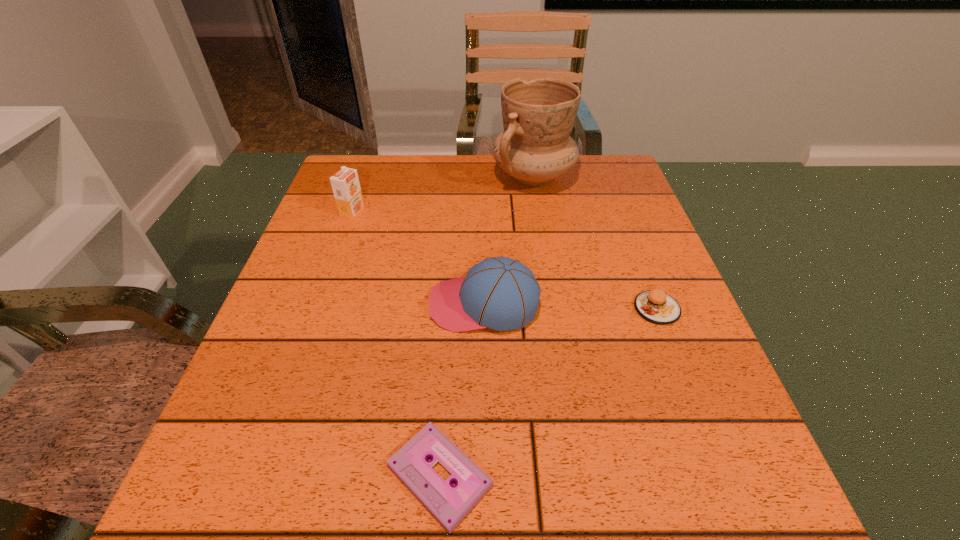
Find the location of a particular element. Image resolution: width=960 pixels, height=540 pixels. patty that is at the right edge is located at coordinates (655, 306).

Where is `object located in the far right corner section of the desktop`? The image size is (960, 540). object located in the far right corner section of the desktop is located at coordinates (535, 147).

Where is `vacant space at the far edge`? The width and height of the screenshot is (960, 540). vacant space at the far edge is located at coordinates (522, 188).

You are a GUI agent. You are given a task and a screenshot of the screen. Output one action in this format:
    pyautogui.click(x=<x>, y=<y>)
    Task: Click on the free space at the left edge of the desktop
    
    Given the screenshot: What is the action you would take?
    pyautogui.click(x=346, y=302)

This screenshot has width=960, height=540. I want to click on vacant space at the right edge of the desktop, so click(x=590, y=221).

The height and width of the screenshot is (540, 960). Find the location of `free space at the far left corner of the desktop`. free space at the far left corner of the desktop is located at coordinates (359, 175).

Locate an element on the screen. The image size is (960, 540). vacant region at the near right corner of the desktop is located at coordinates (650, 478).

Locate an element on the screen. vacant area between the pottery and the rightmost object is located at coordinates (595, 242).

You are a GUI agent. You are given a task and a screenshot of the screen. Output one action in this format:
    pyautogui.click(x=<x>, y=<y>)
    Task: Click on the free spot between the third tallest object and the rightmost object
    
    Given the screenshot: What is the action you would take?
    pyautogui.click(x=570, y=306)

The height and width of the screenshot is (540, 960). I want to click on free area in between the leftmost object and the pottery, so click(443, 194).